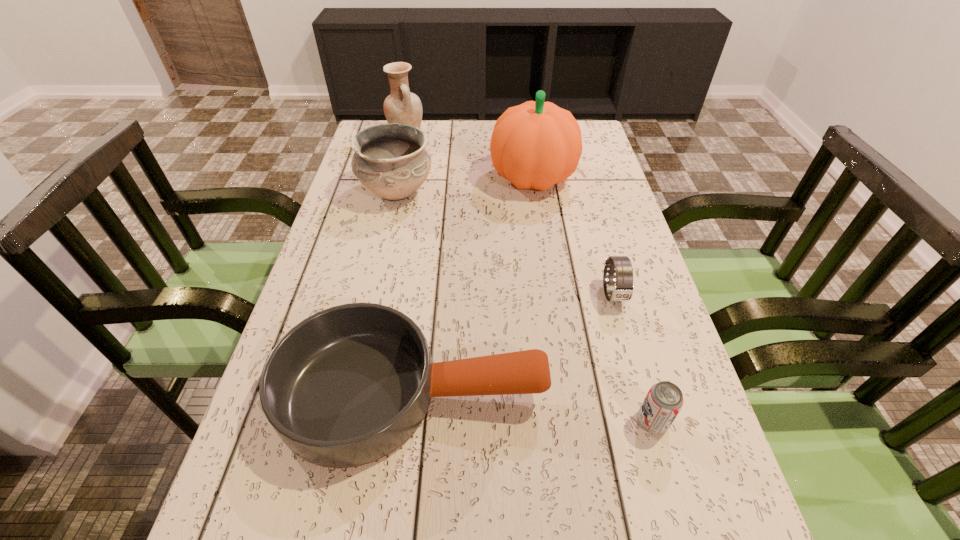
Identify the location of pumpkin. The width and height of the screenshot is (960, 540). (535, 145).

Locate an element on the screen. Image resolution: width=960 pixels, height=540 pixels. the farther pottery is located at coordinates (401, 106).

Locate an element on the screen. the second tallest object is located at coordinates (401, 106).

Find the location of `the third tallest object`. the third tallest object is located at coordinates (391, 160).

The image size is (960, 540). What are the coordinates of `the shorter pottery` in the screenshot? It's located at coord(391,160).

This screenshot has height=540, width=960. In order to click on pan in this screenshot , I will do `click(347, 386)`.

Where is `watch`? watch is located at coordinates (621, 265).

I want to click on beer can, so [x=664, y=400].

I want to click on blank space located 0.100m on the left of the tallest object, so click(x=456, y=178).

Where is `vacant region located on the right of the farthest object`? vacant region located on the right of the farthest object is located at coordinates (451, 135).